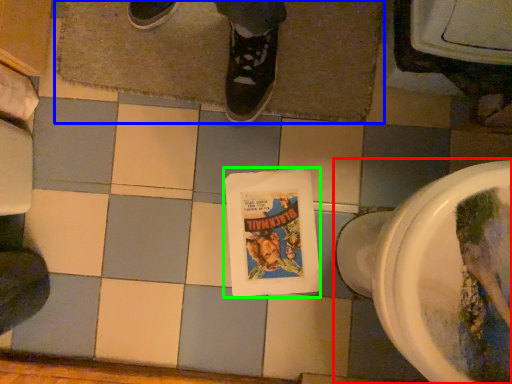
Question: Based on their relative distances, which object is nearer to toilet (highlighted by a red box)? Choose from bath mat (highlighted by a blue box) and comic book (highlighted by a green box).

Choices:
 (A) bath mat
 (B) comic book

Answer: (B)